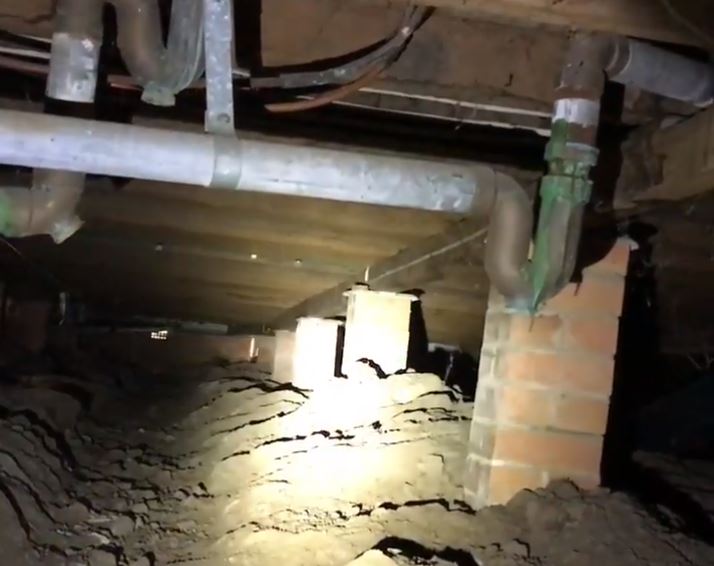
The height and width of the screenshot is (566, 714). In order to click on floorboards in this screenshot , I will do [381, 218], [351, 247], [286, 257], [268, 278], [258, 299], [241, 314].